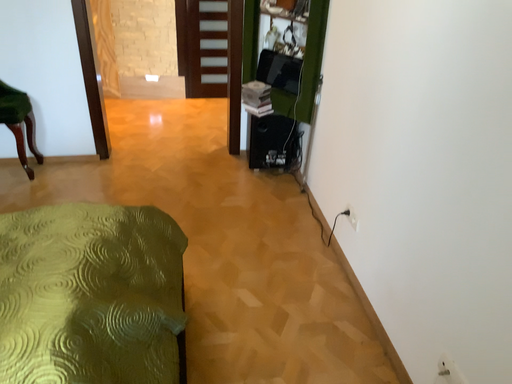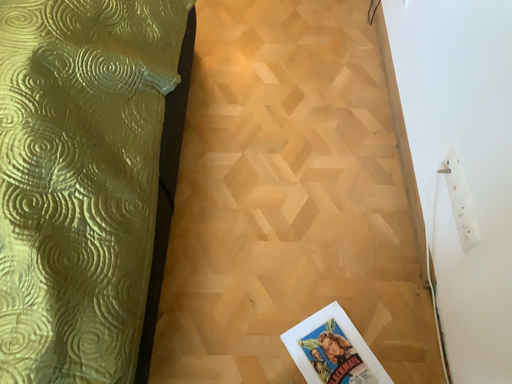
Question: Which way did the camera rotate in the video?

Choices:
 (A) rotated upward
 (B) rotated downward

Answer: (B)